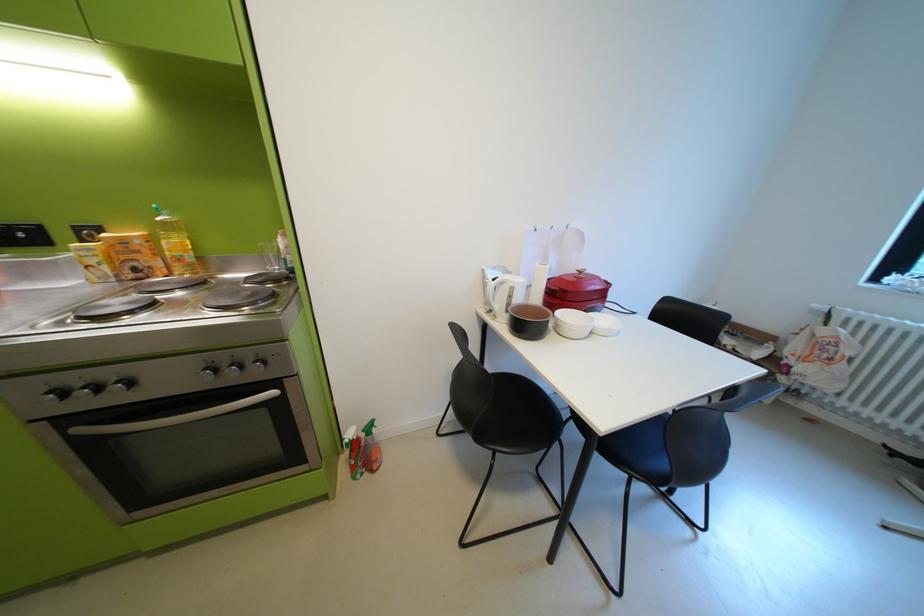
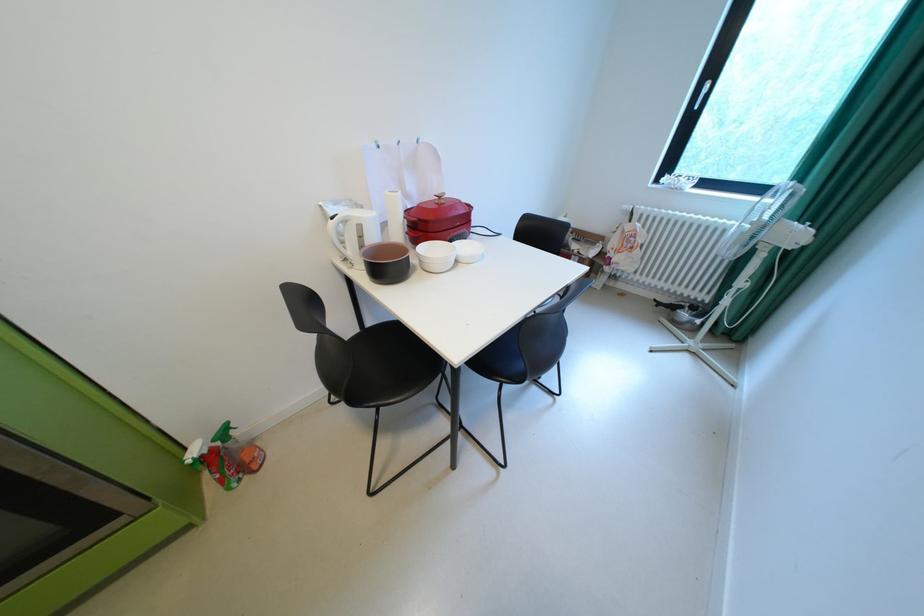
What movement of the cameraman would produce the second image?

The cameraman moved toward right, forward.